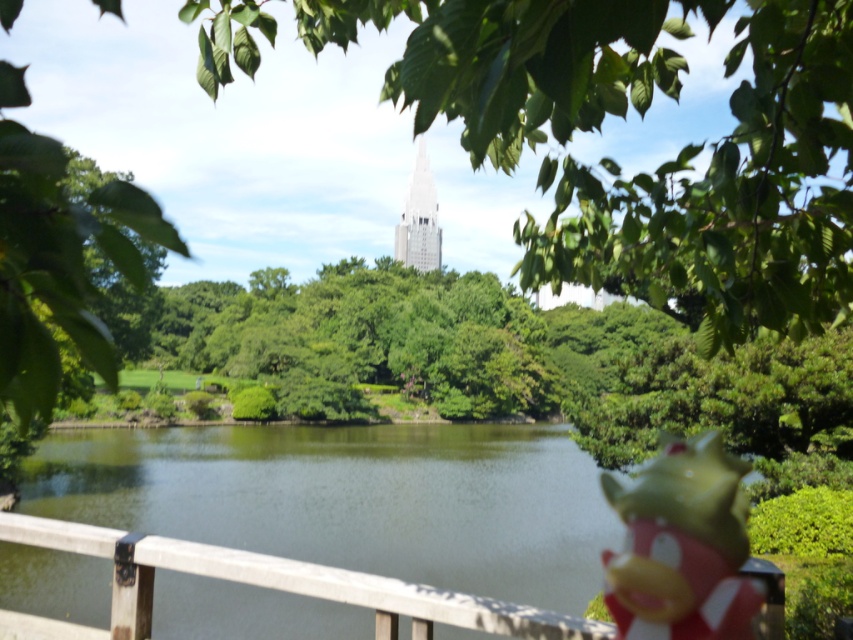
Question: Which point is farther from the camera taking this photo?

Choices:
 (A) (427, 163)
 (B) (518, 564)
 (C) (149, 586)

Answer: (A)

Question: Considering the relative positions of green smooth water at center and rubber duck at lower right in the image provided, where is green smooth water at center located with respect to rubber duck at lower right?

Choices:
 (A) right
 (B) left

Answer: (B)

Question: Does white wood rail at lower center appear on the left side of white glass tower at center?

Choices:
 (A) no
 (B) yes

Answer: (A)

Question: Which object appears closest to the camera in this image?

Choices:
 (A) white glass tower at center
 (B) rubber duck at lower right
 (C) green smooth water at center
 (D) white wood rail at lower center

Answer: (B)

Question: Can you confirm if rubber duck at lower right is wider than white wood rail at lower center?

Choices:
 (A) yes
 (B) no

Answer: (A)

Question: Which object is farther from the camera taking this photo?

Choices:
 (A) rubber duck at lower right
 (B) white glass tower at center
 (C) white wood rail at lower center

Answer: (B)